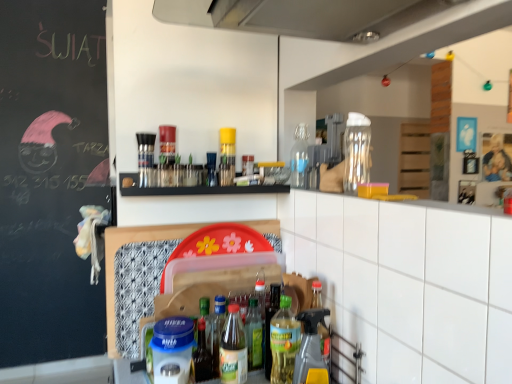
Question: Is transparent glass bottle at upper center, placed as the eleventh bottle when sorted from left to right, with translucent plastic bottle at center, arranged as the seventh bottle when viewed from the right?

Choices:
 (A) no
 (B) yes

Answer: (A)

Question: Can we say transparent glass bottle at upper center, which is the first bottle in right-to-left order, lies outside translucent plastic bottle at center, which is counted as the fifth bottle, starting from the left?

Choices:
 (A) yes
 (B) no

Answer: (A)

Question: Considering the relative positions of transparent glass bottle at upper center, placed as the eleventh bottle when sorted from left to right, and translucent plastic bottle at center, which is counted as the fifth bottle, starting from the left, in the image provided, is transparent glass bottle at upper center, placed as the eleventh bottle when sorted from left to right, behind translucent plastic bottle at center, which is counted as the fifth bottle, starting from the left,?

Choices:
 (A) no
 (B) yes

Answer: (A)

Question: Would you say translucent plastic bottle at center, which is counted as the fifth bottle, starting from the left, is part of transparent glass bottle at upper center, which is the first bottle in right-to-left order,'s contents?

Choices:
 (A) no
 (B) yes

Answer: (A)

Question: Considering the relative positions of transparent glass bottle at upper center, placed as the eleventh bottle when sorted from left to right, and translucent plastic bottle at center, which is counted as the fifth bottle, starting from the left, in the image provided, is transparent glass bottle at upper center, placed as the eleventh bottle when sorted from left to right, to the right of translucent plastic bottle at center, which is counted as the fifth bottle, starting from the left, from the viewer's perspective?

Choices:
 (A) no
 (B) yes

Answer: (B)

Question: Relative to green glass bottle at center, acting as the seventh bottle starting from the left, is translucent plastic bottle at center, arranged as the seventh bottle when viewed from the right, in front or behind?

Choices:
 (A) front
 (B) behind

Answer: (A)

Question: From the image's perspective, is translucent plastic bottle at center, which is counted as the fifth bottle, starting from the left, positioned above or below green glass bottle at center, which ranks as the fifth bottle in right-to-left order?

Choices:
 (A) below
 (B) above

Answer: (A)

Question: In terms of height, does translucent plastic bottle at center, which is counted as the fifth bottle, starting from the left, look taller or shorter compared to green glass bottle at center, which ranks as the fifth bottle in right-to-left order?

Choices:
 (A) tall
 (B) short

Answer: (B)

Question: Is translucent plastic bottle at center, which is counted as the fifth bottle, starting from the left, spatially inside green glass bottle at center, acting as the seventh bottle starting from the left, or outside of it?

Choices:
 (A) inside
 (B) outside

Answer: (B)

Question: From a real-world perspective, is translucent plastic bottle at center, the tenth bottle from the right, above or below translucent glass bottle at center, the first bottle from the left?

Choices:
 (A) below
 (B) above

Answer: (A)

Question: Considering the positions of translucent plastic bottle at center, which is the second bottle in left-to-right order, and translucent glass bottle at center, which is the 11th bottle from right to left, in the image, is translucent plastic bottle at center, which is the second bottle in left-to-right order, taller or shorter than translucent glass bottle at center, which is the 11th bottle from right to left,?

Choices:
 (A) tall
 (B) short

Answer: (A)

Question: In the image, is translucent plastic bottle at center, which is the second bottle in left-to-right order, positioned in front of or behind translucent glass bottle at center, which is the 11th bottle from right to left?

Choices:
 (A) behind
 (B) front

Answer: (B)

Question: Is point [197, 324] closer or farther from the camera than point [167, 147]?

Choices:
 (A) closer
 (B) farther

Answer: (A)

Question: Considering their positions, is translucent plastic spray bottle at lower center, the 9th bottle when ordered from left to right, located in front of or behind translucent plastic bottle at center, which is the second bottle in left-to-right order?

Choices:
 (A) behind
 (B) front

Answer: (B)

Question: Would you say translucent plastic spray bottle at lower center, the 9th bottle when ordered from left to right, is to the left or to the right of translucent plastic bottle at center, the tenth bottle from the right, in the picture?

Choices:
 (A) left
 (B) right

Answer: (B)